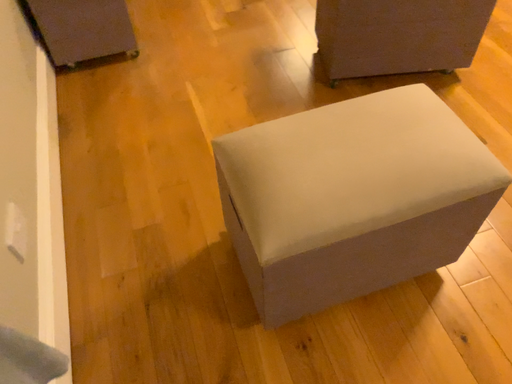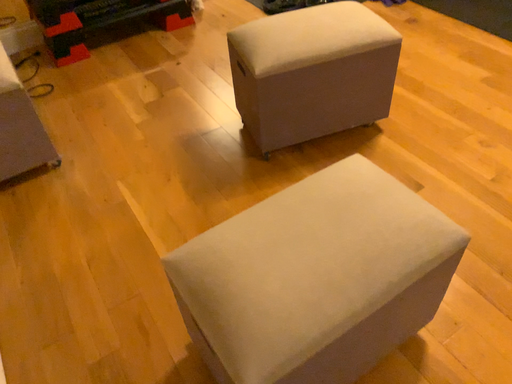
Question: Which way did the camera rotate in the video?

Choices:
 (A) rotated upward
 (B) rotated downward

Answer: (A)